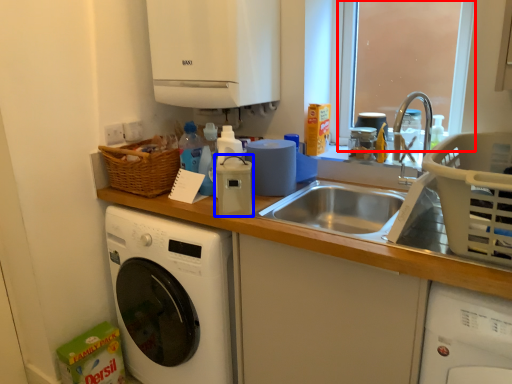
Question: Which object is further to the camera taking this photo, window screen (highlighted by a red box) or appliance (highlighted by a blue box)?

Choices:
 (A) window screen
 (B) appliance

Answer: (A)